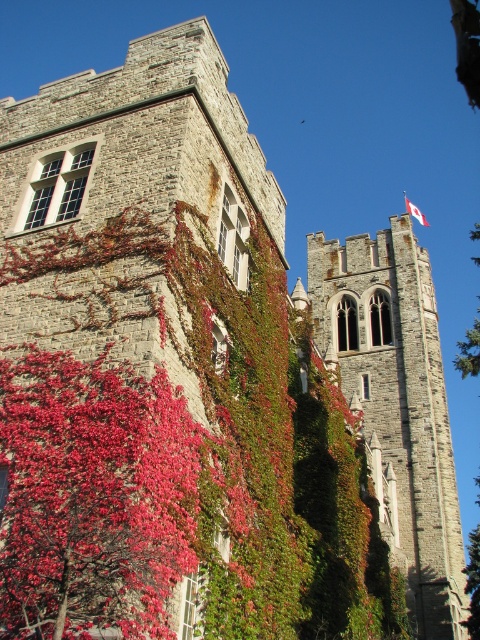
Question: Is vivid red leaves at center further to camera compared to stone tower at upper right?

Choices:
 (A) no
 (B) yes

Answer: (A)

Question: Considering the real-world distances, which object is farthest from the vivid red leaves at center?

Choices:
 (A) white fabric flag at upper right
 (B) stone tower at upper right

Answer: (A)

Question: Which object is farther from the camera taking this photo?

Choices:
 (A) stone tower at upper right
 (B) vivid red leaves at center

Answer: (A)

Question: Does vivid red leaves at center appear on the left side of white fabric flag at upper right?

Choices:
 (A) no
 (B) yes

Answer: (B)

Question: Does vivid red leaves at center appear on the left side of white fabric flag at upper right?

Choices:
 (A) no
 (B) yes

Answer: (B)

Question: Which of the following is the closest to the observer?

Choices:
 (A) (420, 216)
 (B) (169, 518)
 (C) (402, 275)

Answer: (B)